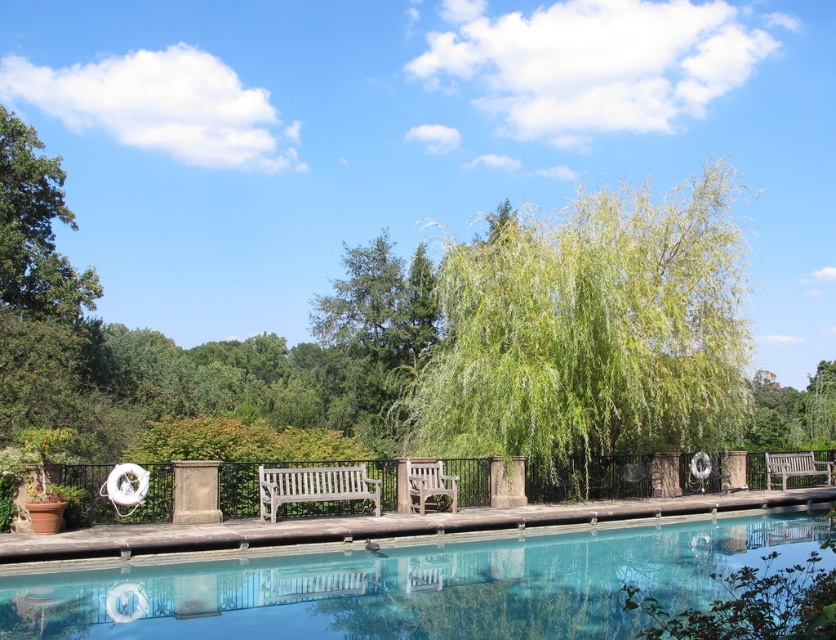
Question: Can you confirm if green leafy willow at center is positioned to the right of clear glass pool at center?

Choices:
 (A) yes
 (B) no

Answer: (A)

Question: Can you confirm if green leafy willow at center is thinner than white wood bench at center?

Choices:
 (A) yes
 (B) no

Answer: (B)

Question: Which is nearer to the light brown wooden bench at right?

Choices:
 (A) green leafy willow at center
 (B) clear glass pool at center
 (C) white wood bench at center

Answer: (A)

Question: In this image, where is green leafy willow at center located relative to white wood bench at center?

Choices:
 (A) below
 (B) above

Answer: (B)

Question: Which point is farther to the camera?

Choices:
 (A) clear glass pool at center
 (B) wooden park bench at center
 (C) light brown wooden bench at right

Answer: (C)

Question: Which of the following is the farthest from the observer?

Choices:
 (A) (x=766, y=460)
 (B) (x=276, y=506)
 (C) (x=415, y=506)
 (D) (x=498, y=268)

Answer: (A)